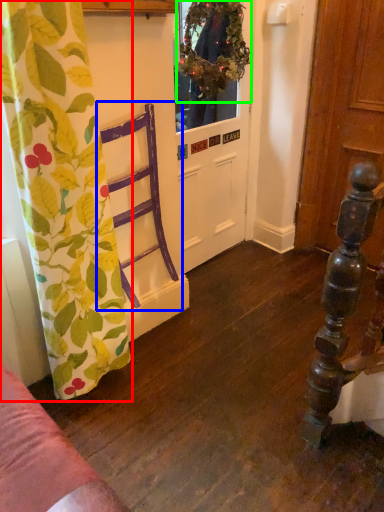
Question: Based on their relative distances, which object is nearer to curtain (highlighted by a red box)? Choose from armchair (highlighted by a blue box) and floral arrangement (highlighted by a green box).

Choices:
 (A) armchair
 (B) floral arrangement

Answer: (A)